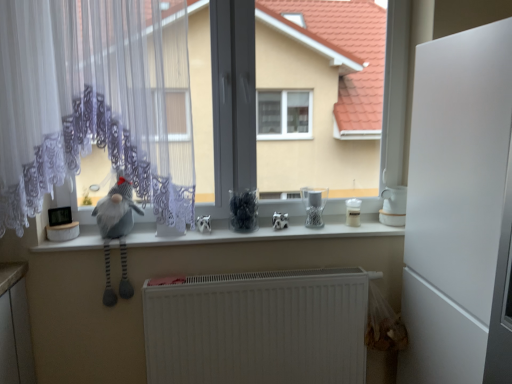
Question: Is white lace curtain at left not close to clear glass jar at center, marked as the first appliance in a left-to-right arrangement?

Choices:
 (A) yes
 (B) no

Answer: (A)

Question: Considering the relative sizes of white lace curtain at left and clear glass jar at center, marked as the first appliance in a left-to-right arrangement, in the image provided, is white lace curtain at left thinner than clear glass jar at center, marked as the first appliance in a left-to-right arrangement,?

Choices:
 (A) no
 (B) yes

Answer: (A)

Question: Is white lace curtain at left positioned with its back to clear glass jar at center, which is counted as the 3th appliance, starting from the right?

Choices:
 (A) yes
 (B) no

Answer: (B)

Question: From a real-world perspective, is white lace curtain at left positioned under clear glass jar at center, which is counted as the 3th appliance, starting from the right, based on gravity?

Choices:
 (A) yes
 (B) no

Answer: (B)

Question: Is white lace curtain at left taller than clear glass jar at center, which is counted as the 3th appliance, starting from the right?

Choices:
 (A) yes
 (B) no

Answer: (A)

Question: Does point (402, 210) appear closer or farther from the camera than point (134, 233)?

Choices:
 (A) farther
 (B) closer

Answer: (A)

Question: Is white glossy teapot at right, acting as the third appliance starting from the left, bigger or smaller than white glossy counter top at center?

Choices:
 (A) big
 (B) small

Answer: (B)

Question: Is white glossy teapot at right, acting as the third appliance starting from the left, inside the boundaries of white glossy counter top at center, or outside?

Choices:
 (A) inside
 (B) outside

Answer: (B)

Question: From the image's perspective, relative to white glossy counter top at center, is white glossy teapot at right, the first appliance positioned from the right, above or below?

Choices:
 (A) above
 (B) below

Answer: (A)

Question: In terms of width, does clear glass jar at center, which is counted as the 3th appliance, starting from the right, look wider or thinner when compared to gray fabric gnome at left?

Choices:
 (A) wide
 (B) thin

Answer: (B)

Question: Considering the positions of clear glass jar at center, which is counted as the 3th appliance, starting from the right, and gray fabric gnome at left in the image, is clear glass jar at center, which is counted as the 3th appliance, starting from the right, bigger or smaller than gray fabric gnome at left?

Choices:
 (A) big
 (B) small

Answer: (B)

Question: From the image's perspective, relative to gray fabric gnome at left, is clear glass jar at center, which is counted as the 3th appliance, starting from the right, above or below?

Choices:
 (A) above
 (B) below

Answer: (A)

Question: Is clear glass jar at center, which is counted as the 3th appliance, starting from the right, in front of or behind gray fabric gnome at left in the image?

Choices:
 (A) behind
 (B) front

Answer: (A)

Question: Relative to white glossy teapot at right, the first appliance positioned from the right, is gray fabric gnome at left in front or behind?

Choices:
 (A) front
 (B) behind

Answer: (A)

Question: Looking at their shapes, would you say gray fabric gnome at left is wider or thinner than white glossy teapot at right, acting as the third appliance starting from the left?

Choices:
 (A) thin
 (B) wide

Answer: (B)